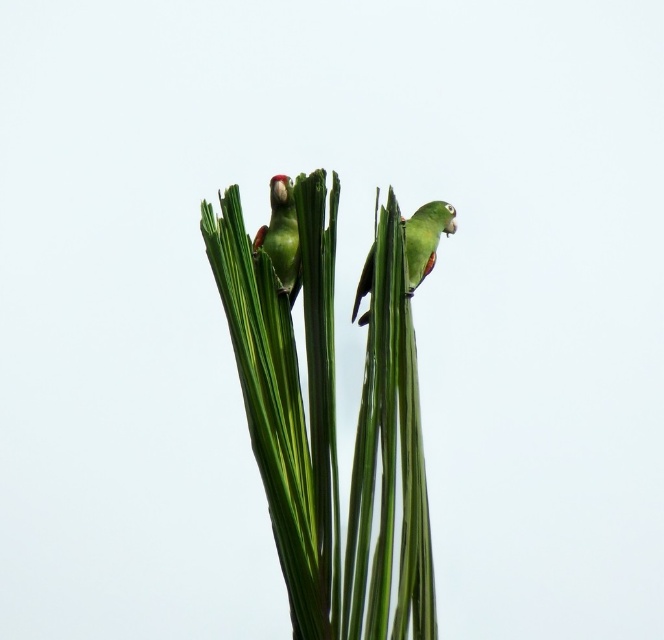
Based on the photo, what is located at the point with coordinates (x=329, y=422) in the image?

The point at coordinates (x=329, y=422) indicates a green leafy plant at center.

Based on the scene description, can you determine if the green leafy plant at center is wider than the green matte parrot at upper center?

The green leafy plant at center is wider than the green matte parrot at upper center according to the description.

You are a birdwatcher observing the scene. You notice the green leafy plant at center and the green matte parrot at center. Which object is taller?

The green leafy plant at center is much taller than the green matte parrot at center.